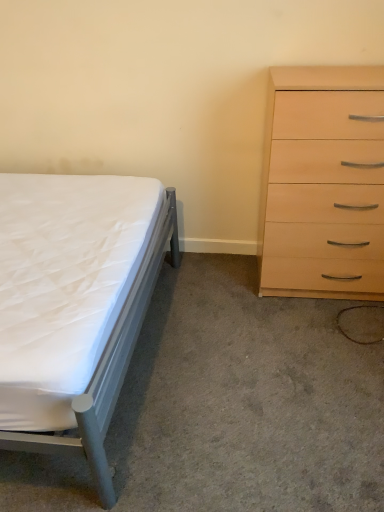
The width and height of the screenshot is (384, 512). Find the location of `space that is in front of light wood/finish chest of drawers at right`. space that is in front of light wood/finish chest of drawers at right is located at coordinates point(321,342).